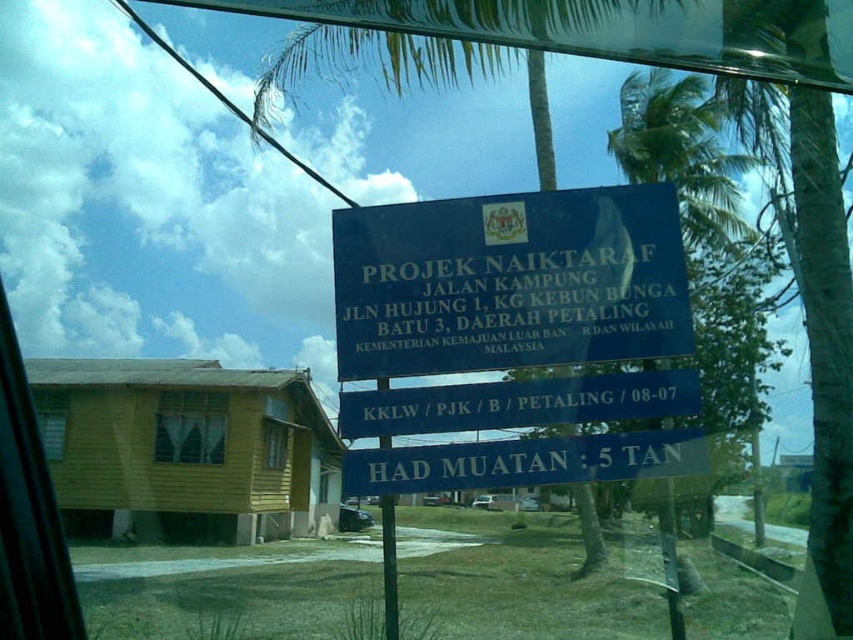
The width and height of the screenshot is (853, 640). Find the location of `blue metallic sign at center`. blue metallic sign at center is located at coordinates (509, 282).

Who is shorter, blue metallic sign at center or blue plastic signboard at center?

Standing shorter between the two is blue plastic signboard at center.

Who is more forward, (651,220) or (703,433)?

Point (703,433) is more forward.

Identify the location of blue metallic sign at center. This screenshot has width=853, height=640. (509, 282).

From the picture: How much distance is there between blue metallic sign at center and green painted wood pole at center?

blue metallic sign at center is 1.75 meters from green painted wood pole at center.

Does blue metallic sign at center have a lesser height compared to green painted wood pole at center?

Yes.

This screenshot has width=853, height=640. Describe the element at coordinates (509, 282) in the screenshot. I see `blue metallic sign at center` at that location.

Where is `blue metallic sign at center`? Image resolution: width=853 pixels, height=640 pixels. blue metallic sign at center is located at coordinates (509, 282).

Is point (387, 476) in front of point (378, 417)?

Yes, it is.

Does blue plastic signboard at center appear under blue plastic sign at center?

Yes, blue plastic signboard at center is below blue plastic sign at center.

Find the location of a particular element. blue plastic signboard at center is located at coordinates (525, 461).